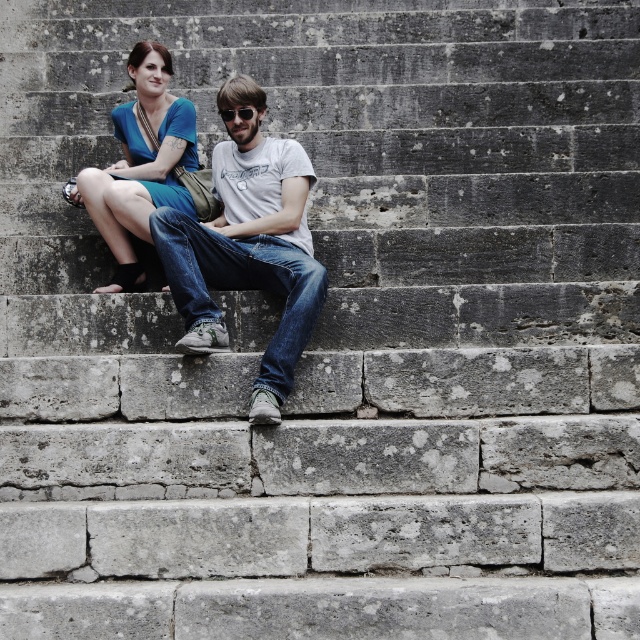
Question: Which of the following is the farthest from the observer?

Choices:
 (A) (144, 227)
 (B) (307, 182)

Answer: (B)

Question: Estimate the real-world distances between objects in this image. Which object is closer to the matte blue dress at center?

Choices:
 (A) denim jeans at center
 (B) black matte sunglasses at center

Answer: (A)

Question: In this image, where is denim jeans at center located relative to matte blue dress at center?

Choices:
 (A) right
 (B) left

Answer: (A)

Question: Which point is closer to the camera?

Choices:
 (A) denim jeans at center
 (B) black matte sunglasses at center

Answer: (A)

Question: Observing the image, what is the correct spatial positioning of matte blue dress at center in reference to black matte sunglasses at center?

Choices:
 (A) below
 (B) above

Answer: (A)

Question: Does matte blue dress at center appear on the right side of black matte sunglasses at center?

Choices:
 (A) yes
 (B) no

Answer: (B)